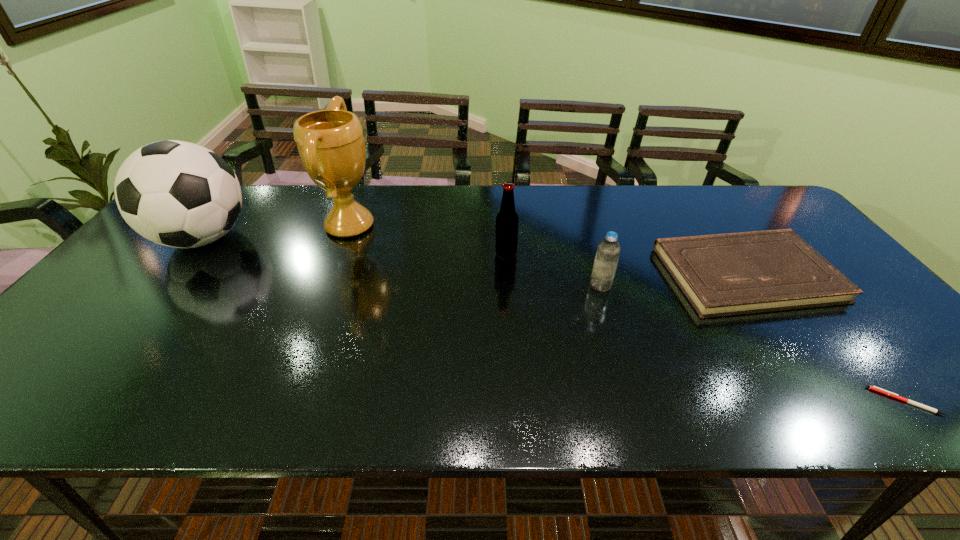
Find the location of `empty space that is in between the second object from left to right and the fifth tallest object`. empty space that is in between the second object from left to right and the fifth tallest object is located at coordinates (548, 250).

The image size is (960, 540). Find the location of `vacant area between the second shortest object and the beer bottle`. vacant area between the second shortest object and the beer bottle is located at coordinates (626, 264).

The width and height of the screenshot is (960, 540). I want to click on free space between the beer bottle and the second shortest object, so click(626, 264).

Find the location of a particular element. unoccupied area between the leftmost object and the paperback book is located at coordinates (474, 256).

Identify the location of empty space between the third tallest object and the water bottle. (553, 269).

The width and height of the screenshot is (960, 540). Identify the location of free space between the pen and the leftmost object. (554, 320).

I want to click on free spot between the soccer ball and the shortest object, so click(x=554, y=320).

Identify the location of unoccupied position between the award and the third shortest object. (475, 255).

This screenshot has height=540, width=960. Identify the location of vacant area between the third tallest object and the fifth object from right to left. (428, 240).

You are a GUI agent. You are given a task and a screenshot of the screen. Output one action in this format:
    pyautogui.click(x=<x>, y=<y>)
    Task: Click on the free space between the beer bottle and the soccer ball
    This screenshot has height=540, width=960.
    Given the screenshot: What is the action you would take?
    pyautogui.click(x=354, y=246)